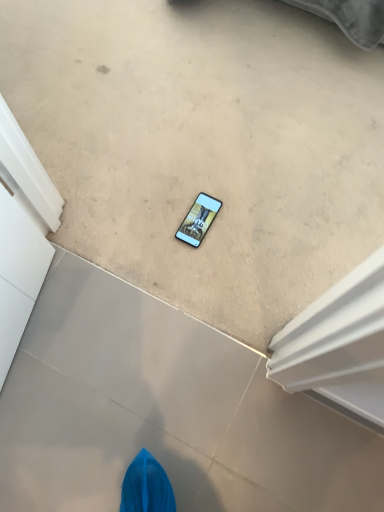
Where is `free space in front of matte black phone at center`? Image resolution: width=384 pixels, height=512 pixels. free space in front of matte black phone at center is located at coordinates (201, 275).